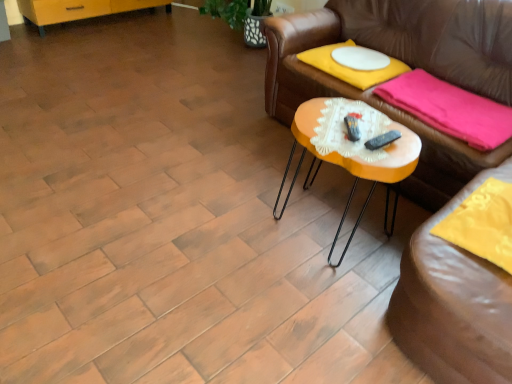
This screenshot has width=512, height=384. What do you see at coordinates (408, 65) in the screenshot?
I see `brown leather couch at center` at bounding box center [408, 65].

The image size is (512, 384). Find the location of `brown leather couch at center`. brown leather couch at center is located at coordinates (408, 65).

This screenshot has width=512, height=384. In order to click on brown leather couch at center in this screenshot , I will do `click(408, 65)`.